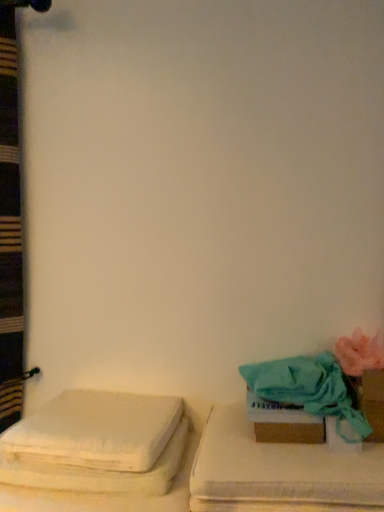
Question: From a real-world perspective, does pink fabric flower at right stand above teal fabric towel at lower right?

Choices:
 (A) yes
 (B) no

Answer: (A)

Question: From a real-world perspective, is pink fabric flower at right positioned under teal fabric towel at lower right based on gravity?

Choices:
 (A) no
 (B) yes

Answer: (A)

Question: Is pink fabric flower at right positioned far away from teal fabric towel at lower right?

Choices:
 (A) no
 (B) yes

Answer: (A)

Question: Considering the relative sizes of pink fabric flower at right and teal fabric towel at lower right in the image provided, is pink fabric flower at right bigger than teal fabric towel at lower right?

Choices:
 (A) no
 (B) yes

Answer: (A)

Question: Is pink fabric flower at right smaller than teal fabric towel at lower right?

Choices:
 (A) no
 (B) yes

Answer: (B)

Question: Looking at the image, does teal fabric cushion at right, which is the 1th furniture in right-to-left order, seem bigger or smaller compared to white fabric cushion at left, arranged as the first furniture when viewed from the left?

Choices:
 (A) small
 (B) big

Answer: (A)

Question: From the image's perspective, is teal fabric cushion at right, which is the second furniture from left to right, located above or below white fabric cushion at left, arranged as the first furniture when viewed from the left?

Choices:
 (A) below
 (B) above

Answer: (B)

Question: Is teal fabric cushion at right, which is the 1th furniture in right-to-left order, taller or shorter than white fabric cushion at left, the 2th furniture positioned from the right?

Choices:
 (A) short
 (B) tall

Answer: (A)

Question: Would you say teal fabric cushion at right, which is the 1th furniture in right-to-left order, is to the left or to the right of white fabric cushion at left, arranged as the first furniture when viewed from the left, in the picture?

Choices:
 (A) left
 (B) right

Answer: (B)

Question: Considering the positions of teal fabric towel at lower right and brown cardboard box at lower right in the image, is teal fabric towel at lower right bigger or smaller than brown cardboard box at lower right?

Choices:
 (A) small
 (B) big

Answer: (B)

Question: From a real-world perspective, is teal fabric towel at lower right physically located above or below brown cardboard box at lower right?

Choices:
 (A) above
 (B) below

Answer: (A)

Question: Is teal fabric towel at lower right inside the boundaries of brown cardboard box at lower right, or outside?

Choices:
 (A) outside
 (B) inside

Answer: (A)

Question: Is teal fabric towel at lower right to the left or to the right of brown cardboard box at lower right in the image?

Choices:
 (A) right
 (B) left

Answer: (A)

Question: Looking at their shapes, would you say white fabric cushion at left, the 2th furniture positioned from the right, is wider or thinner than pink fabric flower at right?

Choices:
 (A) thin
 (B) wide

Answer: (B)

Question: Is white fabric cushion at left, the 2th furniture positioned from the right, taller or shorter than pink fabric flower at right?

Choices:
 (A) tall
 (B) short

Answer: (A)